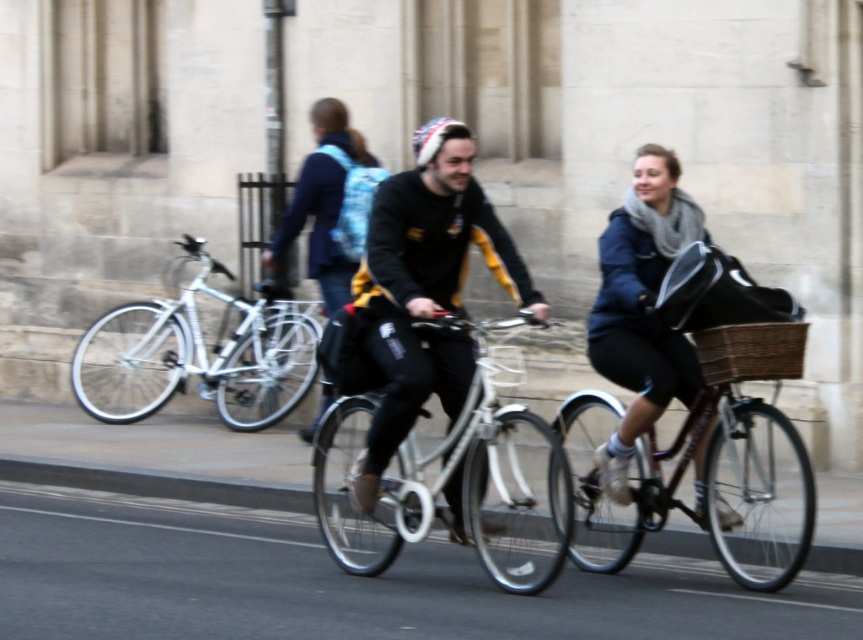
Who is taller, matte black bicycle at center or woven brown basket at center?

matte black bicycle at center is taller.

Consider the image. Does matte black bicycle at center have a smaller size compared to woven brown basket at center?

No.

Is point (439, 218) behind point (709, 371)?

Yes, it is.

I want to click on matte black bicycle at center, so (x=424, y=291).

Who is more distant from viewer, (139, 344) or (364, 148)?

Point (139, 344)

Measure the distance between point [208,291] and camera.

Point [208,291] is 13.89 meters away from camera.

Is point (139, 362) positioned behind point (331, 314)?

Yes, point (139, 362) is behind point (331, 314).

Image resolution: width=863 pixels, height=640 pixels. I want to click on white metallic bicycle at center, so click(x=197, y=353).

Can you confirm if woven brown basket at center is positioned below white fabric helmet at center?

Yes, woven brown basket at center is below white fabric helmet at center.

Between point (713, 342) and point (419, 132), which one is positioned behind?

The point (419, 132) is more distant.

Where is `woven brown basket at center`? The width and height of the screenshot is (863, 640). woven brown basket at center is located at coordinates (750, 352).